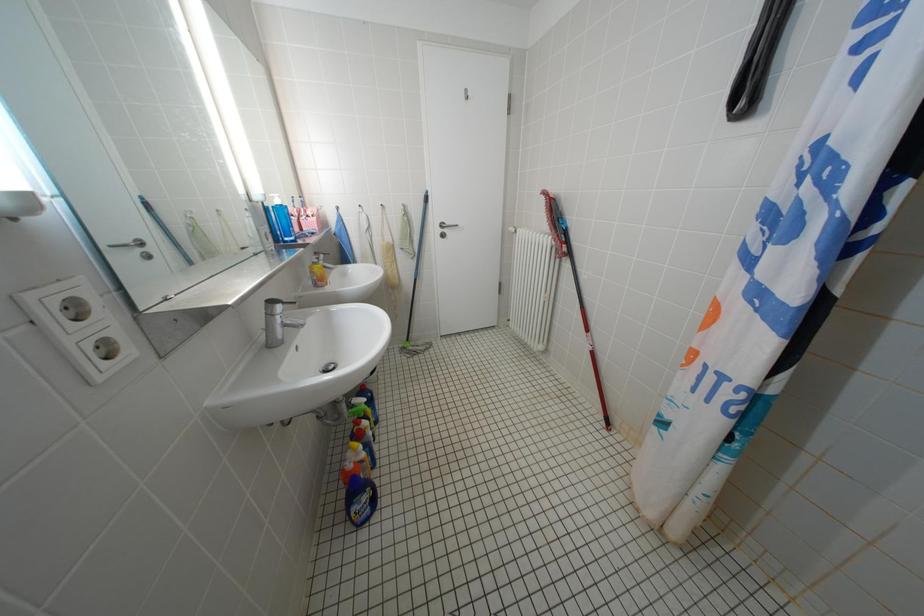
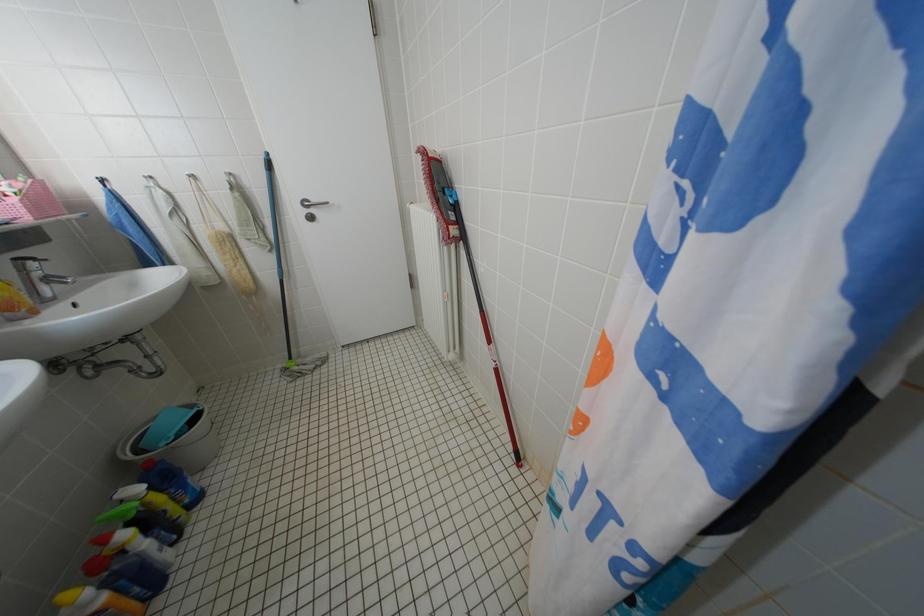
Question: The camera is either moving clockwise (left) or counter-clockwise (right) around the object. The first image is from the beginning of the video and the second image is from the end. Is the camera moving left or right when shooting the video?

Choices:
 (A) Left
 (B) Right

Answer: (A)